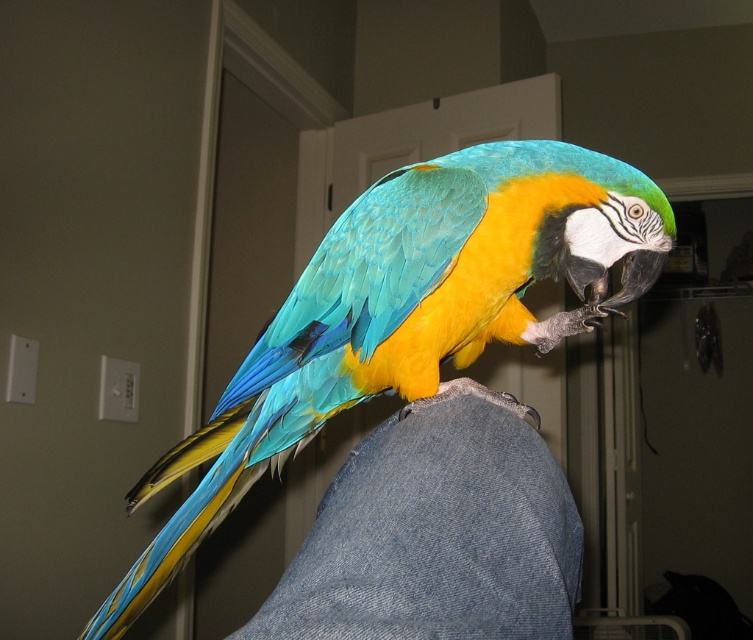
The image size is (753, 640). Describe the element at coordinates (407, 316) in the screenshot. I see `shiny blue-green parrot at center` at that location.

Between point (462, 378) and point (514, 593), which one is positioned in front?

Point (514, 593)

Locate an element on the screen. shiny blue-green parrot at center is located at coordinates (407, 316).

What are the coordinates of `shiny blue-green parrot at center` in the screenshot? It's located at (407, 316).